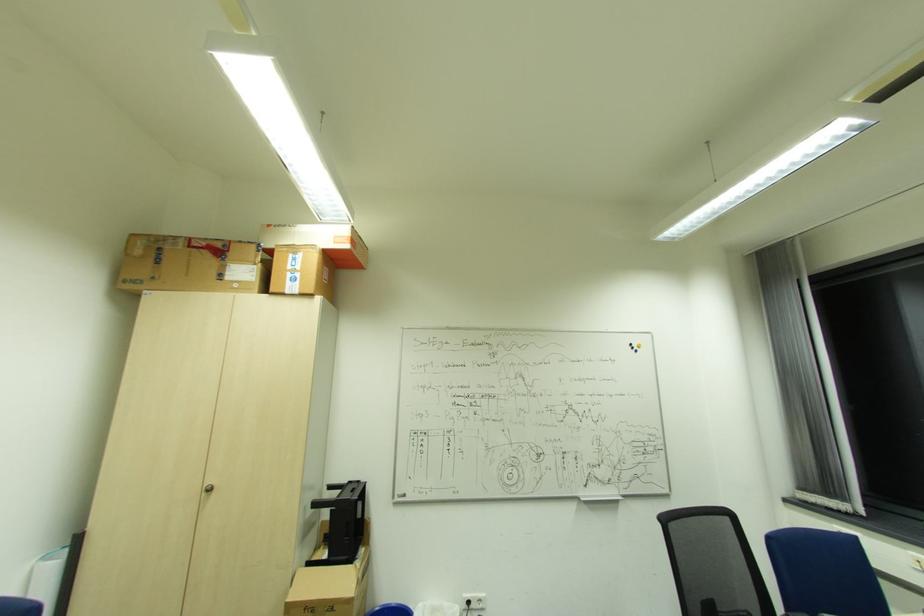
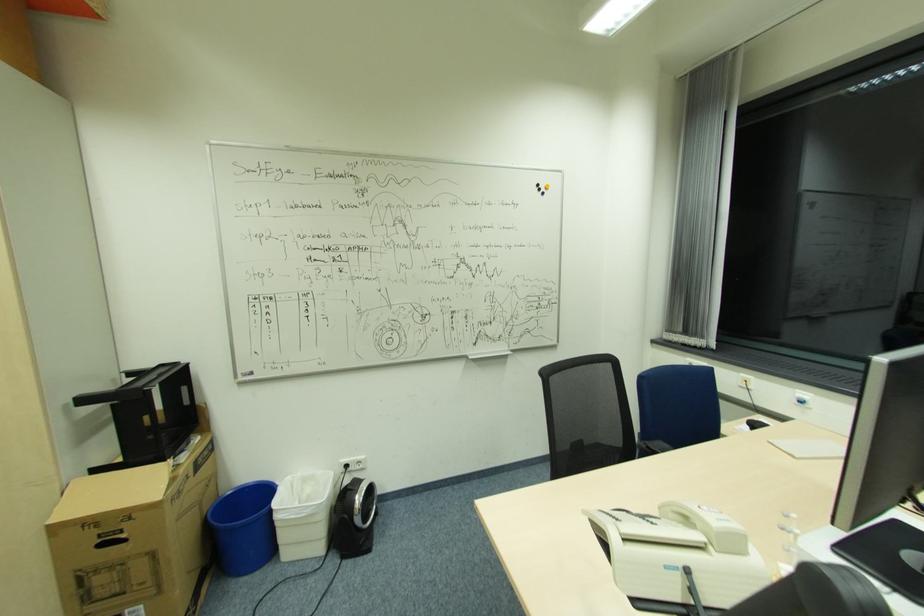
Where in the second image is the point corresponding to the point at 633,344 from the first image?

(541, 185)